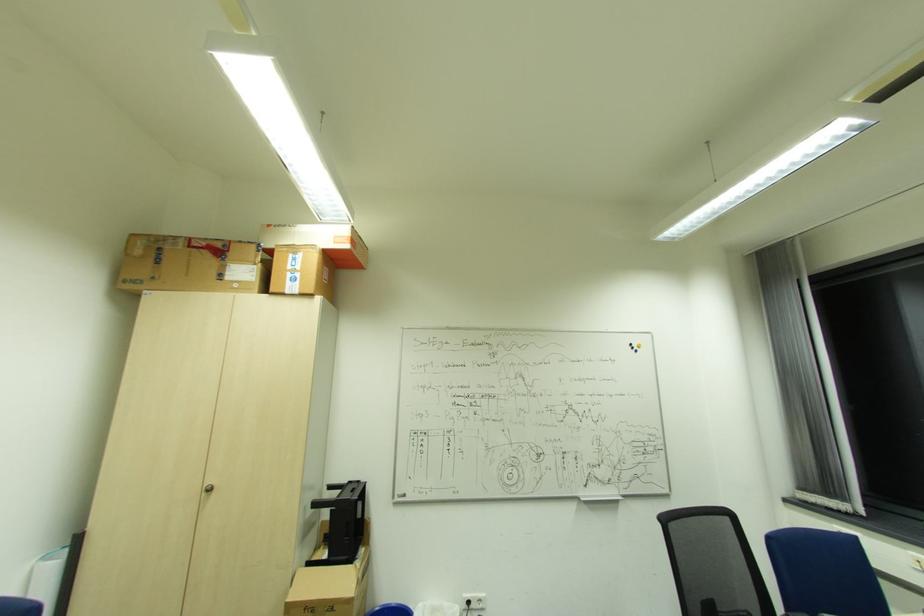
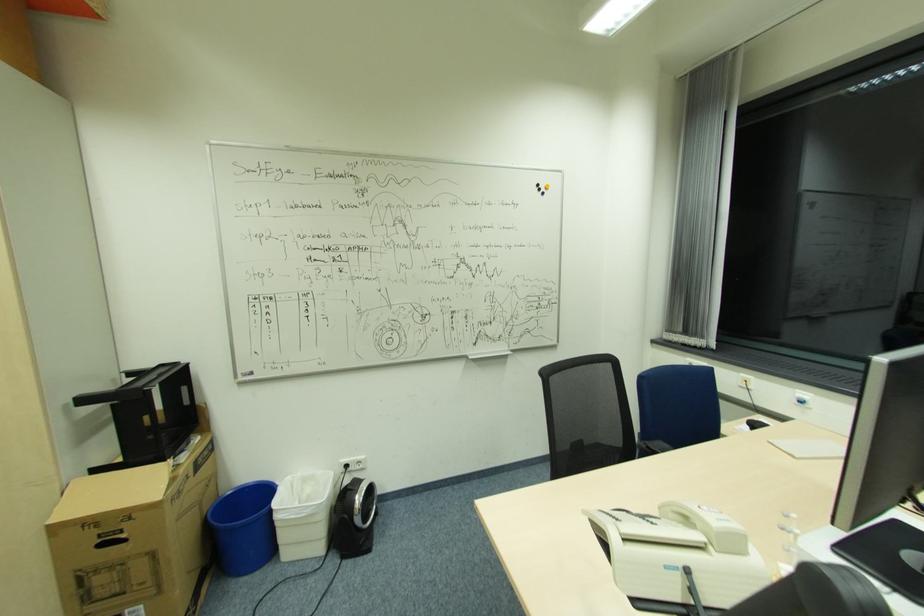
Where in the second image is the point corresponding to the point at 633,344 from the first image?

(541, 185)